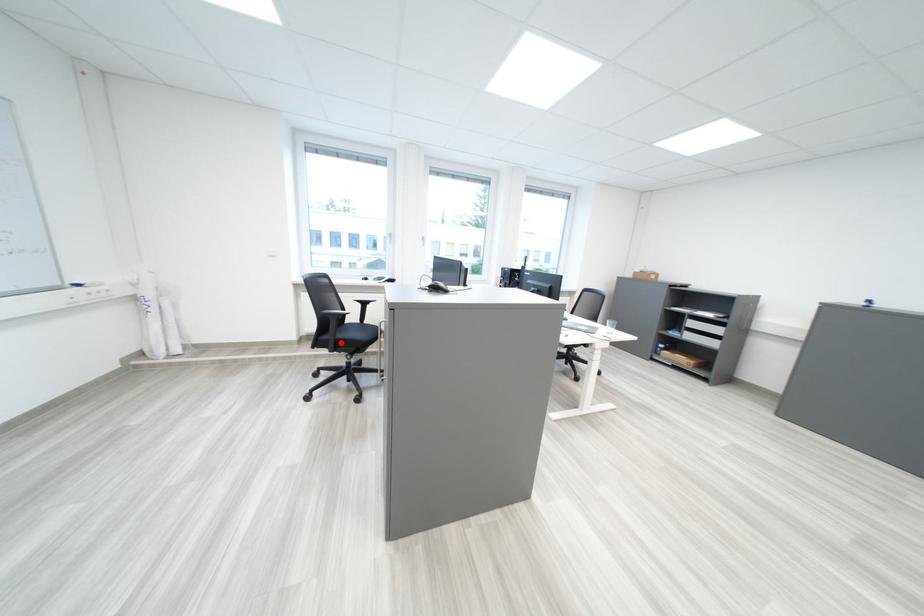
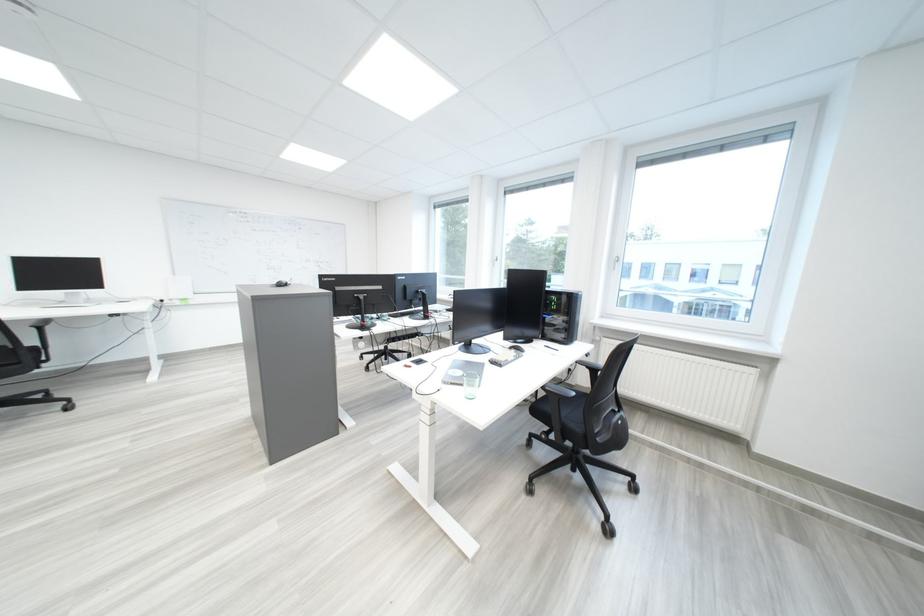
Question: I am providing you with two images of the same scene from different viewpoints. A red point is marked on the first image. Is the red point's position out of view in image 2?

Choices:
 (A) Yes
 (B) No

Answer: (A)